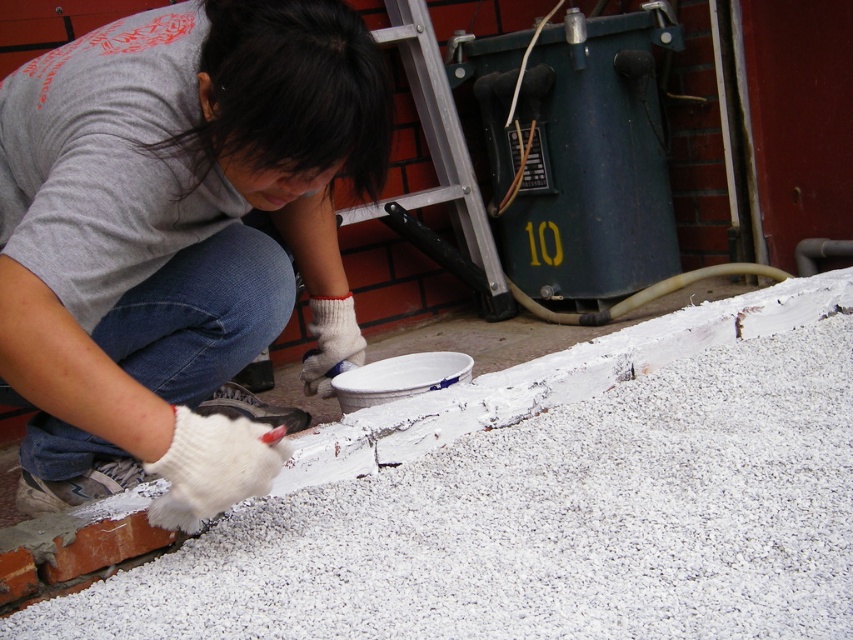
Between white granular gravel at center and white matte paintbrush at lower center, which one has more height?

white matte paintbrush at lower center

What do you see at coordinates (546, 500) in the screenshot? This screenshot has height=640, width=853. I see `white granular gravel at center` at bounding box center [546, 500].

Who is more distant from viewer, (602,625) or (73,340)?

Point (73,340)

Find the location of a particular element. The width and height of the screenshot is (853, 640). white granular gravel at center is located at coordinates (546, 500).

Is white matte paintbrush at lower center above brushed metal ladder at upper center?

No.

Find the location of `white matte paintbrush at lower center`. white matte paintbrush at lower center is located at coordinates (177, 237).

Does point (363, 556) come behind point (401, 51)?

No, it is in front of (401, 51).

Is point (637, 326) closer to viewer compared to point (494, 253)?

Yes, it is.

The image size is (853, 640). Describe the element at coordinates (546, 500) in the screenshot. I see `white granular gravel at center` at that location.

You are a GUI agent. You are given a task and a screenshot of the screen. Output one action in this format:
    pyautogui.click(x=<x>, y=<y>)
    Task: Click on the white granular gravel at center
    This screenshot has width=853, height=640.
    Given the screenshot: What is the action you would take?
    pyautogui.click(x=546, y=500)